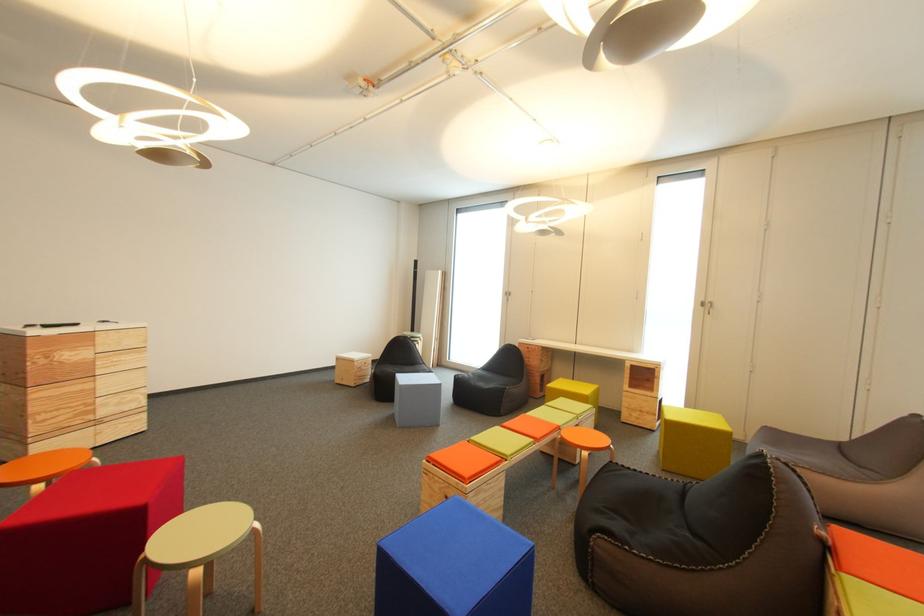
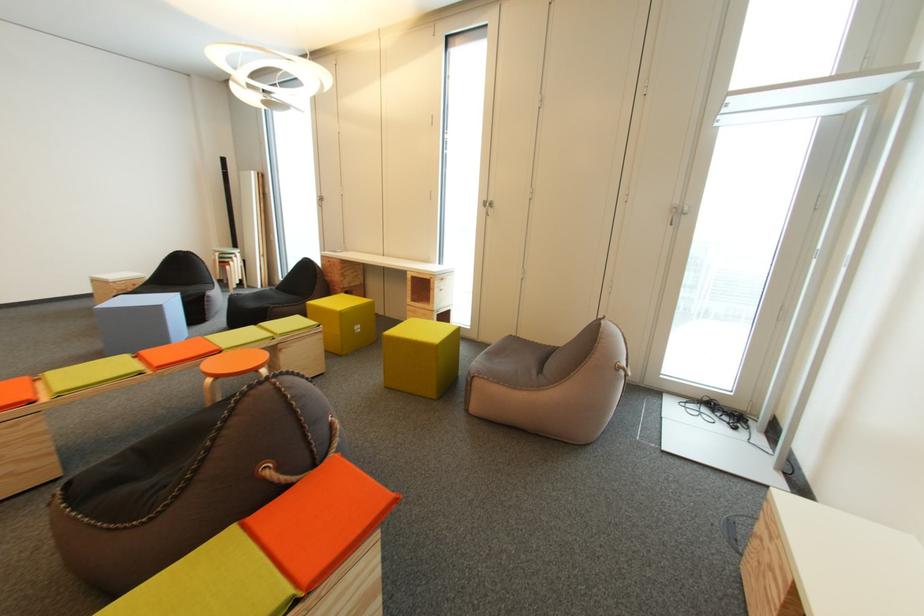
Question: Which direction would the cameraman need to move to produce the second image? Reply with the corresponding letter.

Choices:
 (A) Left
 (B) Right
 (C) Forward
 (D) Backward

Answer: (B)